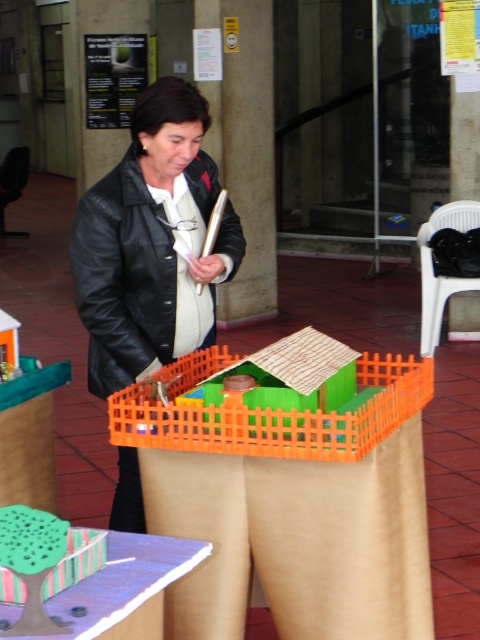
Question: Which of the following is the closest to the observer?

Choices:
 (A) (199, 211)
 (B) (24, 515)
 (C) (188, 564)
 (D) (213, 438)

Answer: (B)

Question: Which point is closer to the camera?

Choices:
 (A) black leather jacket at center
 (B) green felt tree at lower left
 (C) matte green paper at lower left
 (D) green plastic house at center

Answer: (C)

Question: Can you confirm if green plastic house at center is wider than green felt tree at lower left?

Choices:
 (A) yes
 (B) no

Answer: (A)

Question: Is green plastic house at center below matte green paper at lower left?

Choices:
 (A) yes
 (B) no

Answer: (B)

Question: Among these points, which one is nearest to the camera?

Choices:
 (A) (386, 400)
 (B) (240, 241)
 (C) (111, 598)
 (D) (29, 513)

Answer: (D)

Question: Does green plastic house at center come behind green felt tree at lower left?

Choices:
 (A) yes
 (B) no

Answer: (A)